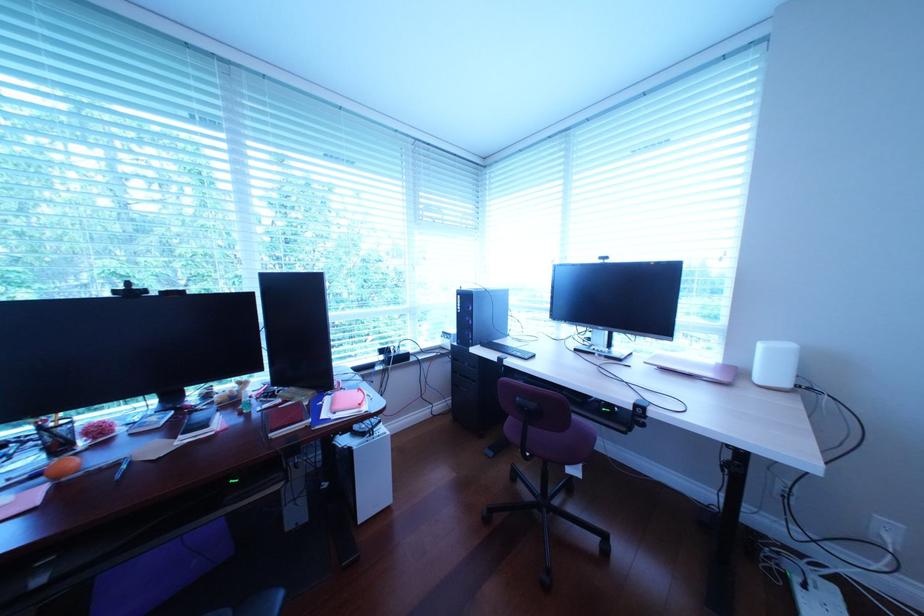
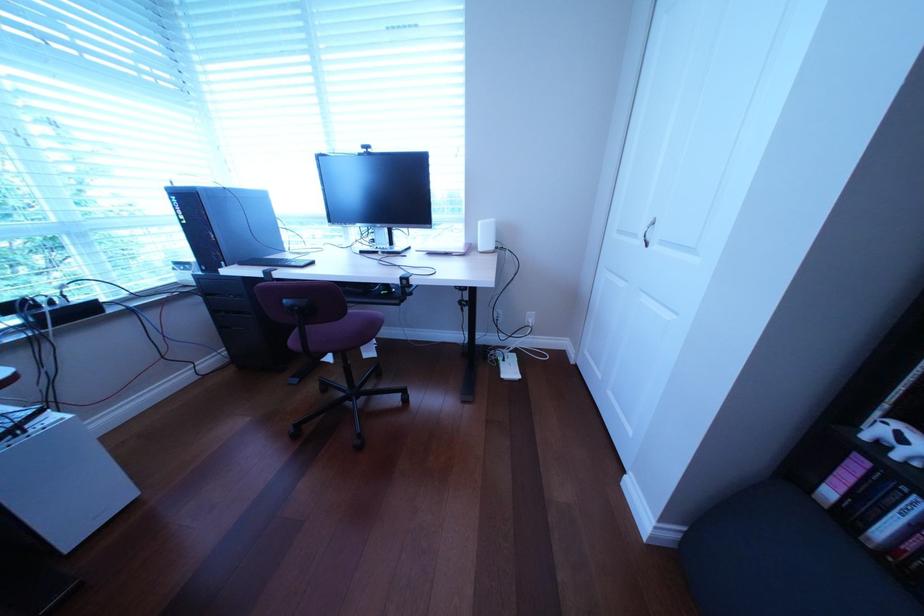
The images are taken continuously from a first-person perspective. In which direction is your viewpoint rotating?

The camera rotated toward right-down.